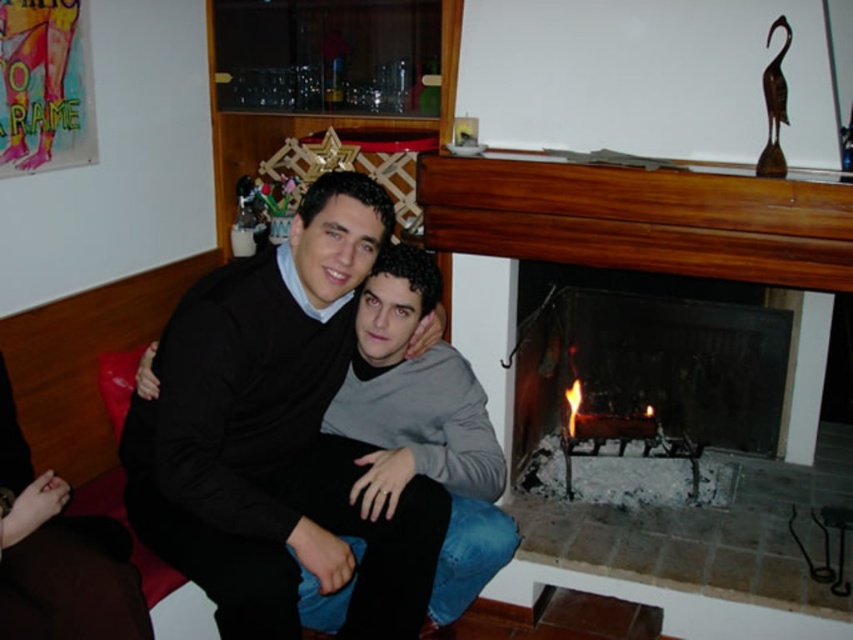
Does point (654, 227) come closer to viewer compared to point (448, 536)?

No.

This screenshot has height=640, width=853. Find the location of `wooden fireplace at right`. wooden fireplace at right is located at coordinates 642,220.

Is point (352, 458) farther from camera compared to point (630, 308)?

No, it is in front of (630, 308).

Can you confirm if matte black sweater at center is wider than charcoal gray stone fireplace at right?

No, matte black sweater at center is not wider than charcoal gray stone fireplace at right.

What do you see at coordinates (279, 436) in the screenshot? I see `matte black sweater at center` at bounding box center [279, 436].

Where is `matte black sweater at center`? The height and width of the screenshot is (640, 853). matte black sweater at center is located at coordinates (279, 436).

The height and width of the screenshot is (640, 853). What do you see at coordinates (643, 388) in the screenshot?
I see `charcoal gray stone fireplace at right` at bounding box center [643, 388].

Is point (734, 394) positioned after point (397, 467)?

Yes, point (734, 394) is farther from viewer.

Where is `charcoal gray stone fireplace at right`? charcoal gray stone fireplace at right is located at coordinates (643, 388).